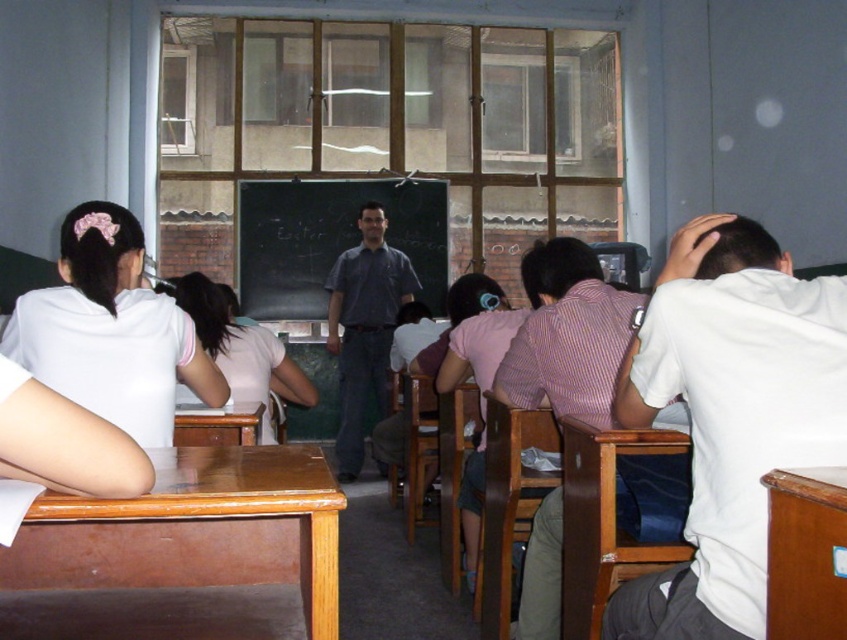
You are a student sitting in the classroom and want to place your backpack on the nearest surface. Which object between the brown polished wood table at lower left and the brown wooden desk at lower left is closer to you?

The brown polished wood table at lower left is located below the brown wooden desk at lower left, so it is closer to you.

You are a student trying to place a tall textbook on either the brown polished wood table at lower left or the brown wooden desk at lower left. Which surface will allow the textbook to be more visible to you while sitting at your seat?

The brown polished wood table at lower left has a greater height compared to the brown wooden desk at lower left, so placing the textbook there will make it more visible.

You are a student sitting at the desk in the classroom. You notice a point on the wall at coordinates (109, 330). What object is located at that point?

The point at coordinates (109, 330) corresponds to the white matte shirt at left.